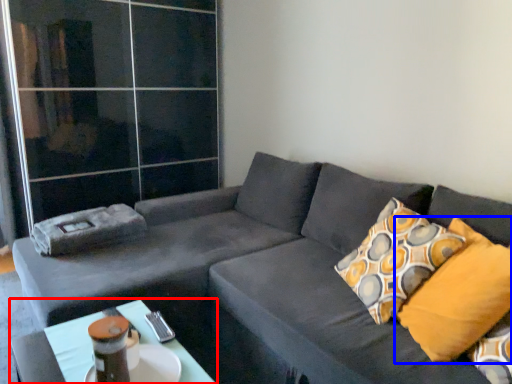
Question: Among these objects, which one is nearest to the camera, table (highlighted by a red box) or pillow (highlighted by a blue box)?

Choices:
 (A) table
 (B) pillow

Answer: (A)